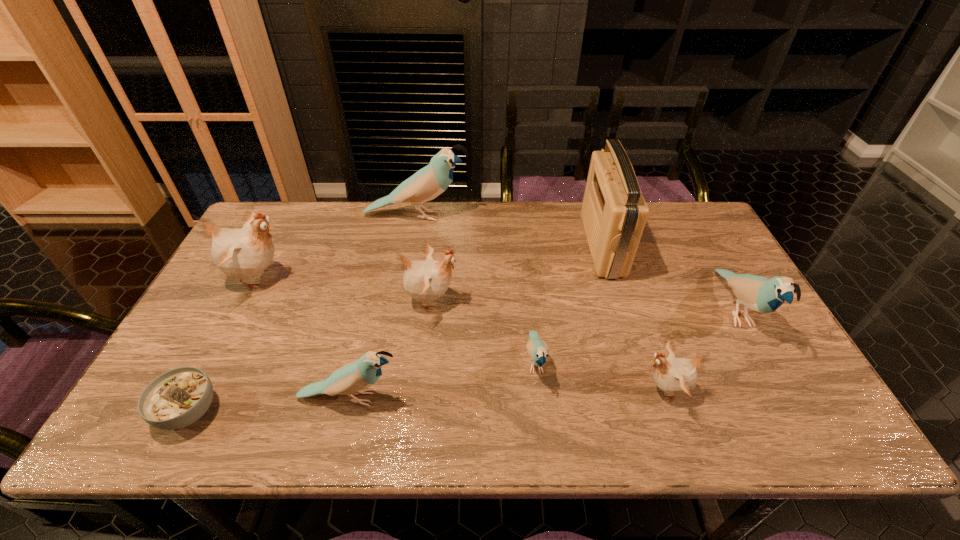
What are the coordinates of `beige radio receiver` in the screenshot? It's located at (614, 212).

What are the coordinates of `the farthest bird` in the screenshot? It's located at (429, 182).

Find the location of a particular element. the biggest blue bird is located at coordinates (429, 182).

Where is `the leftmost white bird`? The width and height of the screenshot is (960, 540). the leftmost white bird is located at coordinates (242, 253).

In order to click on the biggest white bird in this screenshot , I will do [x=242, y=253].

This screenshot has width=960, height=540. Identify the location of the third smallest blue bird. (757, 293).

Where is `the rightmost object`? The height and width of the screenshot is (540, 960). the rightmost object is located at coordinates (757, 293).

Where is `the second white bird from left to right`? The width and height of the screenshot is (960, 540). the second white bird from left to right is located at coordinates (425, 281).

This screenshot has height=540, width=960. In order to click on the third biggest blue bird in this screenshot , I will do `click(354, 378)`.

Identify the location of the nearest white bird. (676, 376).